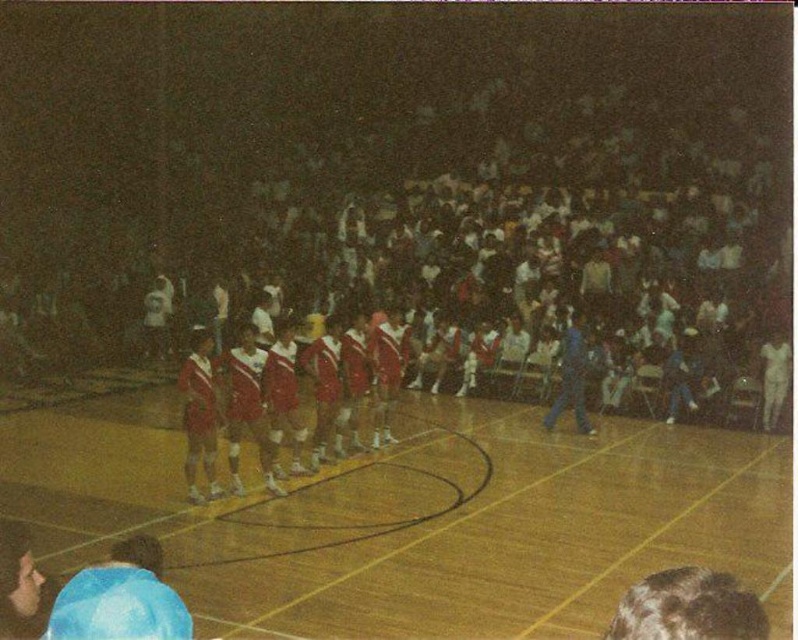
Between point (784, 474) and point (188, 412), which one is positioned in front?

Positioned in front is point (188, 412).

What do you see at coordinates (409, 516) in the screenshot?
I see `wooden basketball court at center` at bounding box center [409, 516].

This screenshot has width=798, height=640. What do you see at coordinates (409, 516) in the screenshot?
I see `wooden basketball court at center` at bounding box center [409, 516].

Find the location of a particular element. wooden basketball court at center is located at coordinates (409, 516).